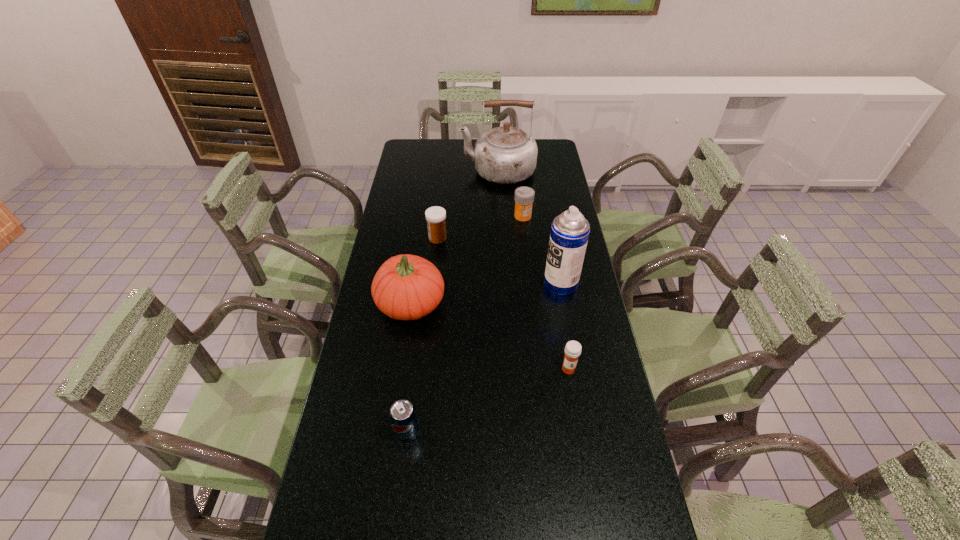
In the image, there is a desktop. Where is `free space at the far left corner`? free space at the far left corner is located at coordinates (408, 146).

This screenshot has width=960, height=540. Identify the location of vacant space at the far right corner of the desktop. (554, 156).

This screenshot has height=540, width=960. I want to click on free spot between the leftmost medicine and the soda can, so click(x=422, y=335).

Where is `vacant area that lies between the soda can and the aerosol can`? vacant area that lies between the soda can and the aerosol can is located at coordinates (484, 357).

The width and height of the screenshot is (960, 540). I want to click on vacant area that lies between the nearest object and the farthest object, so click(452, 302).

Locate an element on the screen. This screenshot has width=960, height=540. free space between the second nearest medicine and the aerosol can is located at coordinates pyautogui.click(x=499, y=261).

Locate an element on the screen. This screenshot has width=960, height=540. vacant region between the aerosol can and the farthest medicine is located at coordinates (541, 250).

Identify the location of unoccupied area between the pumpkin and the second farthest object. The height and width of the screenshot is (540, 960). click(x=467, y=259).

At what (x,y) coordinates should I click in order to perform the action: click on free point between the fifth shortest object and the farthest medicine. Please return your answer as a coordinate pair (x, y). The height and width of the screenshot is (540, 960). Looking at the image, I should click on (467, 259).

Locate an element on the screen. Image resolution: width=960 pixels, height=540 pixels. vacant area between the nearest medicine and the pumpkin is located at coordinates (490, 336).